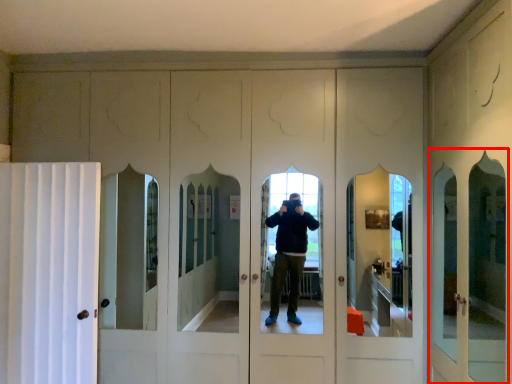
Question: From the image's perspective, what is the correct spatial positioning of screen door (annotated by the red box) in reference to curtain?

Choices:
 (A) above
 (B) below

Answer: (A)